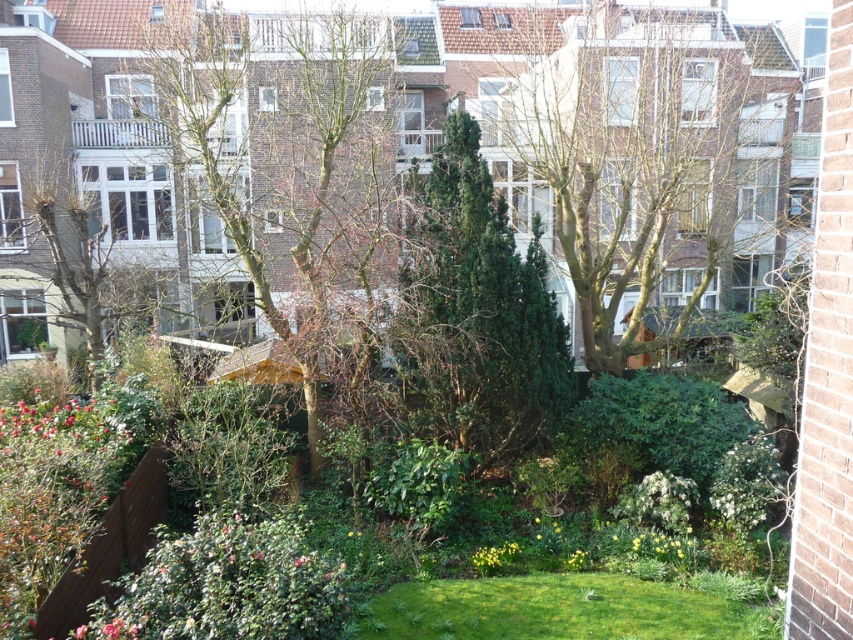
Who is positioned more to the left, green leafy tree at center or green grass at center?

From the viewer's perspective, green grass at center appears more on the left side.

Does green leafy tree at center have a greater height compared to green grass at center?

Yes.

Does point (693, 285) lie behind point (467, 627)?

Yes, point (693, 285) is behind point (467, 627).

This screenshot has height=640, width=853. In order to click on green leafy tree at center in this screenshot , I will do `click(639, 150)`.

Can you confirm if green textured tree at center is shorter than green leafy bush at lower left?

No.

Between green textured tree at center and green leafy bush at lower left, which one appears on the right side from the viewer's perspective?

green textured tree at center

Is point (408, 378) closer to camera compared to point (326, 572)?

No, (408, 378) is further to viewer.

In order to click on green textured tree at center in this screenshot , I will do `click(474, 312)`.

Is point (489, 360) farther from viewer compared to point (573, 593)?

Yes, it is.

Is the position of green textured tree at center less distant than that of green grass at center?

No, green textured tree at center is further to the viewer.

Does point (403, 304) come closer to viewer compared to point (439, 598)?

No, (403, 304) is behind (439, 598).

You are a GUI agent. You are given a task and a screenshot of the screen. Output one action in this format:
    pyautogui.click(x=<x>, y=<y>)
    Task: Click on the green textured tree at center
    
    Given the screenshot: What is the action you would take?
    pyautogui.click(x=474, y=312)